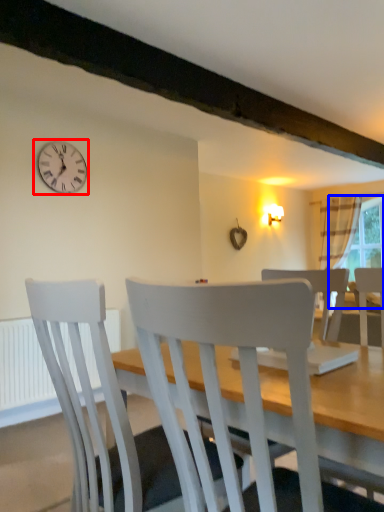
Question: Among these objects, which one is farthest to the camera, wall clock (highlighted by a red box) or window screen (highlighted by a blue box)?

Choices:
 (A) wall clock
 (B) window screen

Answer: (B)